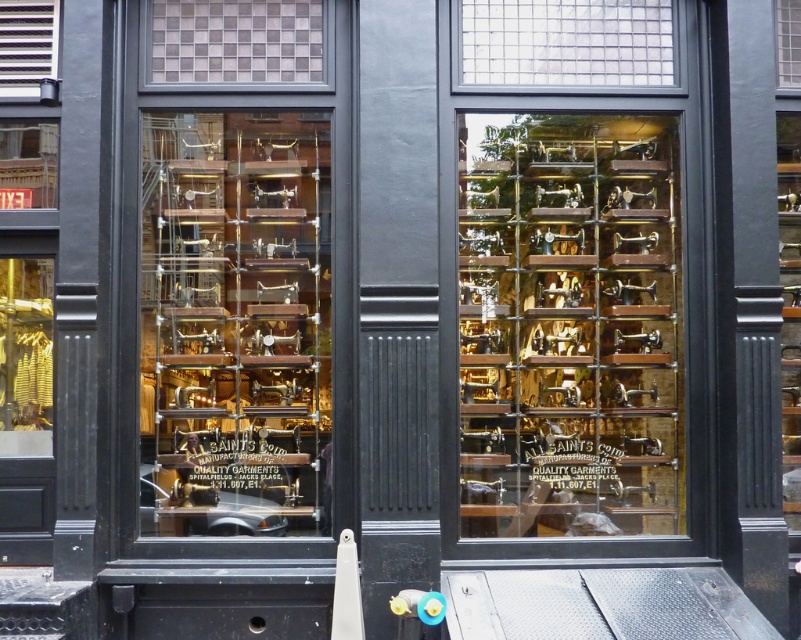
Question: Considering the real-world distances, which object is closest to the clear glass window at upper right?

Choices:
 (A) wooden sewing machines at left
 (B) gold metallic sewing machines at center

Answer: (B)

Question: Can you confirm if gold metallic sewing machines at center is thinner than metallic vent at upper left?

Choices:
 (A) no
 (B) yes

Answer: (A)

Question: Estimate the real-world distances between objects in this image. Which object is closer to the clear glass grid at upper center?

Choices:
 (A) checkered glass at upper center
 (B) clear glass window at upper right

Answer: (B)

Question: Is gold metallic sewing machines at center to the left of red digital sign at upper left from the viewer's perspective?

Choices:
 (A) no
 (B) yes

Answer: (A)

Question: Which of the following is the farthest from the observer?

Choices:
 (A) (25, 76)
 (B) (670, 124)
 (C) (25, 179)

Answer: (B)

Question: Can you confirm if checkered glass at upper center is positioned above clear glass window at upper right?

Choices:
 (A) no
 (B) yes

Answer: (A)